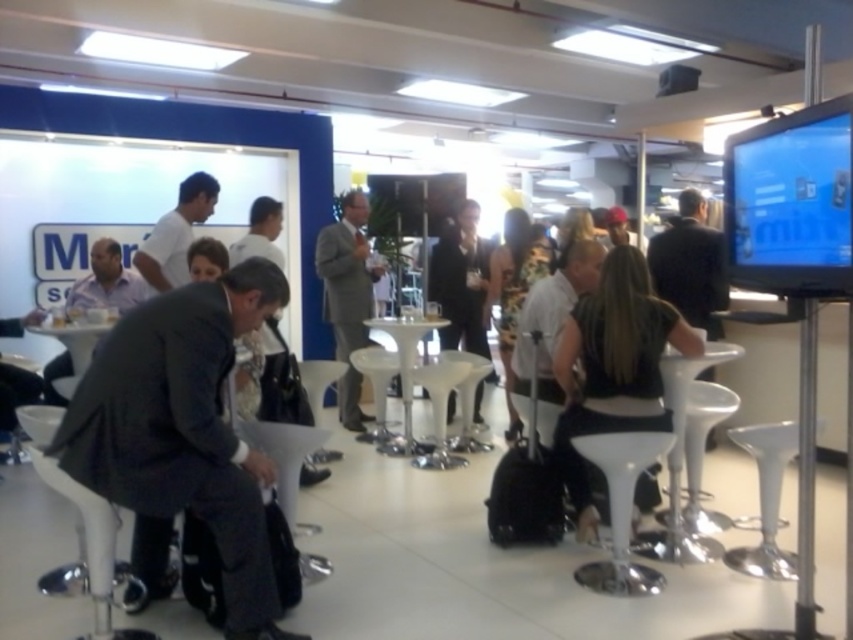
Who is more distant from viewer, (30, 444) or (312, 403)?

Positioned behind is point (30, 444).

Is white plastic bar stool at lower left to the right of white plastic bar stool at center from the viewer's perspective?

In fact, white plastic bar stool at lower left is to the left of white plastic bar stool at center.

Describe the element at coordinates (91, 545) in the screenshot. Image resolution: width=853 pixels, height=640 pixels. I see `white plastic bar stool at lower left` at that location.

In order to click on white plastic bar stool at lower left in this screenshot , I will do `click(91, 545)`.

Can you confirm if dark suit at center is bigger than white shirt at upper center?

Yes.

Can you confirm if dark suit at center is positioned above white shirt at upper center?

No, dark suit at center is not above white shirt at upper center.

The width and height of the screenshot is (853, 640). What are the coordinates of `dark suit at center` in the screenshot? It's located at (461, 280).

In order to click on dark suit at center in this screenshot , I will do `click(461, 280)`.

Can you confirm if black fabric dress at center is positioned to the left of white plastic bar stool at lower left?

Incorrect, black fabric dress at center is not on the left side of white plastic bar stool at lower left.

Can you confirm if black fabric dress at center is thinner than white plastic bar stool at lower left?

Incorrect, black fabric dress at center's width is not less than white plastic bar stool at lower left's.

Identify the location of black fabric dress at center. (613, 368).